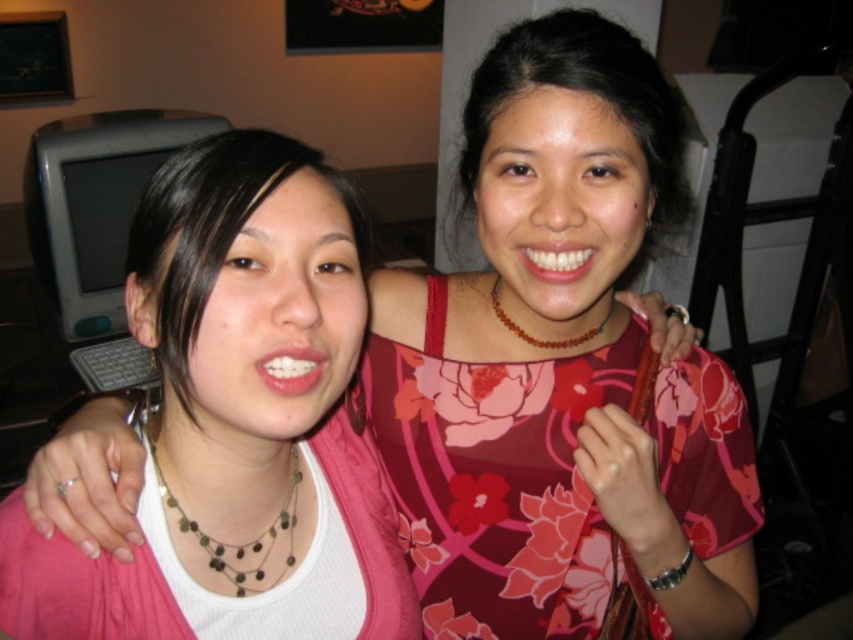
Question: Is pink fabric shirt at center thinner than floral print fabric dress at center?

Choices:
 (A) no
 (B) yes

Answer: (B)

Question: Which object appears farthest from the camera in this image?

Choices:
 (A) green stone necklace at center
 (B) brown leather necklace at upper center
 (C) floral print fabric dress at center

Answer: (B)

Question: Which object is positioned closest to the floral print fabric dress at center?

Choices:
 (A) green stone necklace at center
 (B) brown leather necklace at upper center
 (C) pink fabric shirt at center

Answer: (B)

Question: From the image, what is the correct spatial relationship of pink fabric shirt at center in relation to green stone necklace at center?

Choices:
 (A) right
 (B) left

Answer: (A)

Question: Considering the real-world distances, which object is closest to the pink fabric shirt at center?

Choices:
 (A) green stone necklace at center
 (B) brown leather necklace at upper center

Answer: (A)

Question: Does floral print fabric dress at center appear over green stone necklace at center?

Choices:
 (A) yes
 (B) no

Answer: (B)